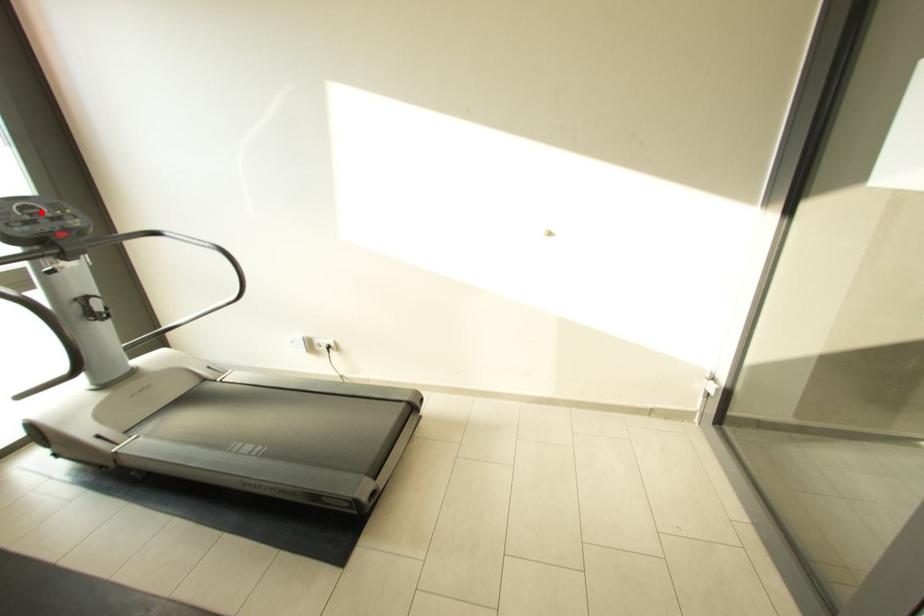
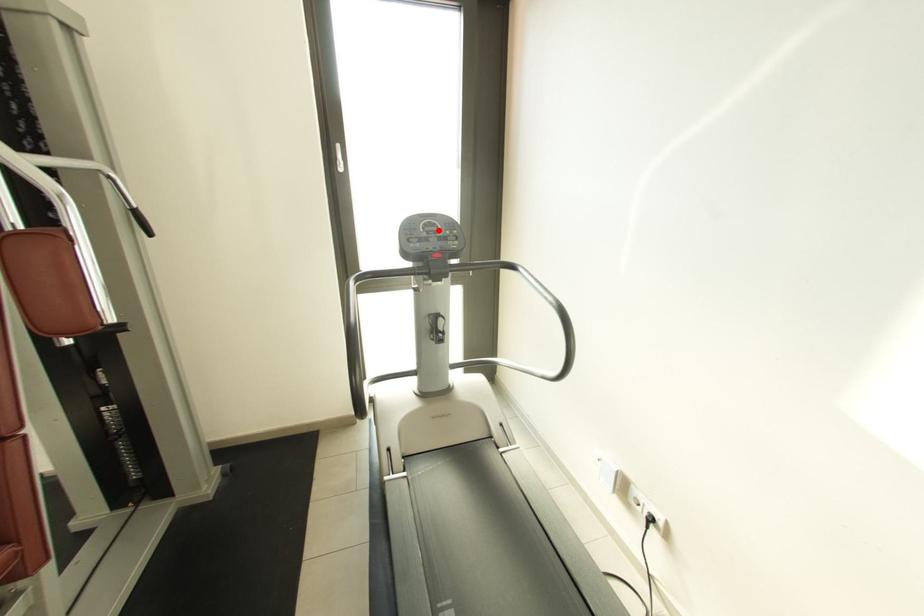
I am providing you with two images of the same scene from different viewpoints. A red point is marked on the first image and another point is marked on the second image. Is the marked point in image1 the same physical position as the marked point in image2?

Yes